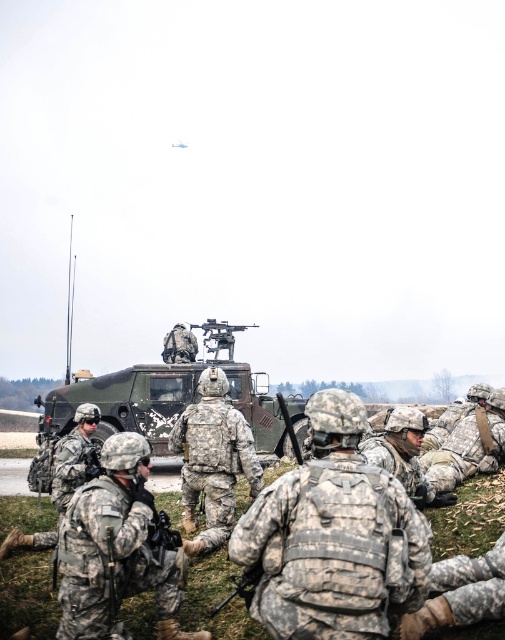
You are a soldier in the training exercise and need to quickly grab an item from the ground. Which item, the camouflage fabric backpack at center or the camouflage uniform at center, can you pick up with one hand due to its size?

The camouflage fabric backpack at center has a smaller size compared to the camouflage uniform at center, so you can pick up the camouflage fabric backpack at center with one hand.

You are a photographer positioned at the camera location. You want to capture a closeup shot of the camouflage uniform at center. Given that your camera has a minimum focusing distance of 10 feet, will you be able to take the photo without moving closer?

The camouflage uniform at center is 18.36 feet away from the camera, which is beyond the minimum focusing distance of 10 feet. Therefore, you can take the closeup shot without needing to move closer.

You are a photographer at the scene and want to capture a photo that includes both the camouflage uniform at center and the camouflage fabric uniform at lower right. From the perspective of someone standing at the front of the military vehicle, which direction should you move to ensure both uniforms are visible in the frame?

You should move to the left side of the military vehicle because the camouflage uniform at center is located below the camouflage fabric uniform at lower right, so adjusting your position to the left will allow both to be captured in the photo.